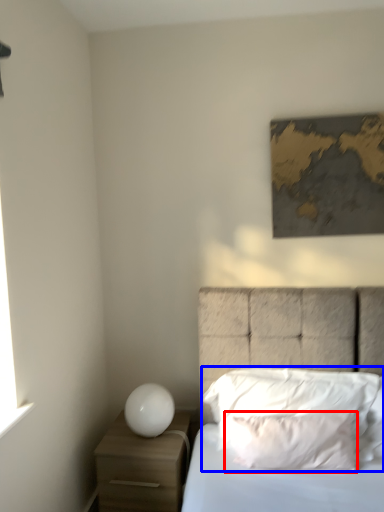
Question: Which object is closer to the camera taking this photo, pillow (highlighted by a red box) or pillow (highlighted by a blue box)?

Choices:
 (A) pillow
 (B) pillow

Answer: (A)